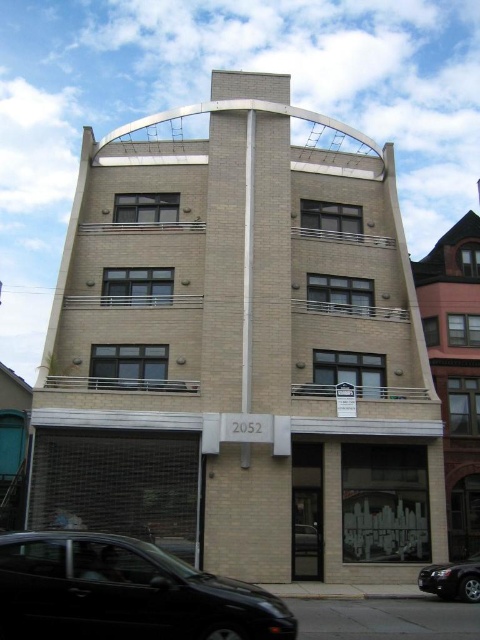
From the picture: Is shiny black car at lower left smaller than black glossy sedan at lower right?

No.

This screenshot has height=640, width=480. What are the coordinates of `shiny black car at lower left` in the screenshot? It's located at point(123,593).

Locate an element on the screen. shiny black car at lower left is located at coordinates (123, 593).

The width and height of the screenshot is (480, 640). What are the coordinates of `shiny black car at lower left` in the screenshot? It's located at (123, 593).